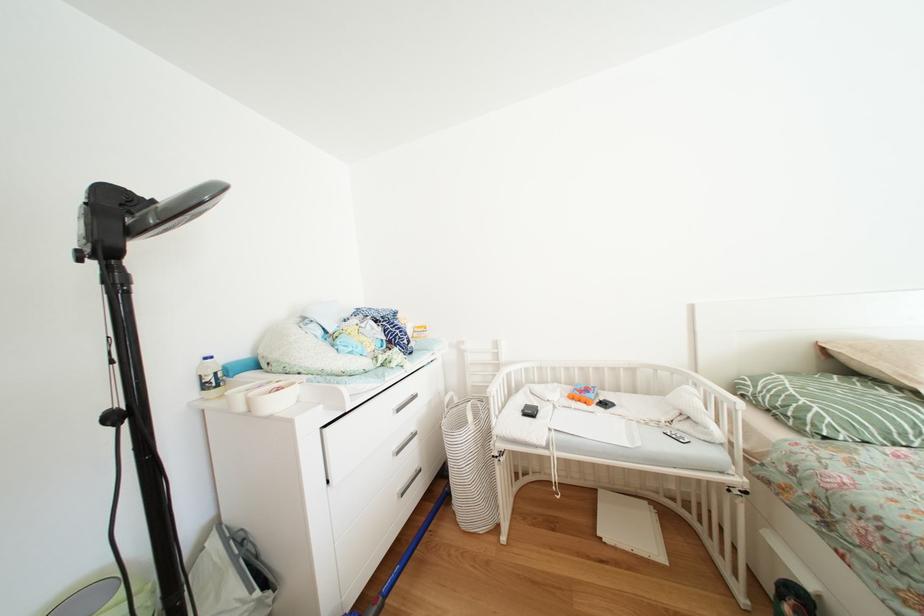
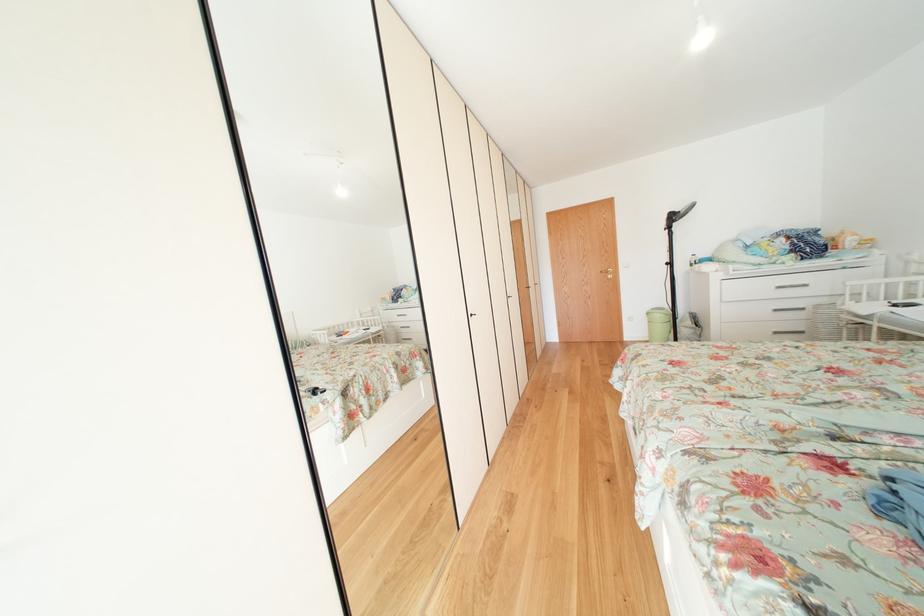
Locate, in the second image, the point that corresponds to (x=407, y=458) in the first image.

(784, 315)